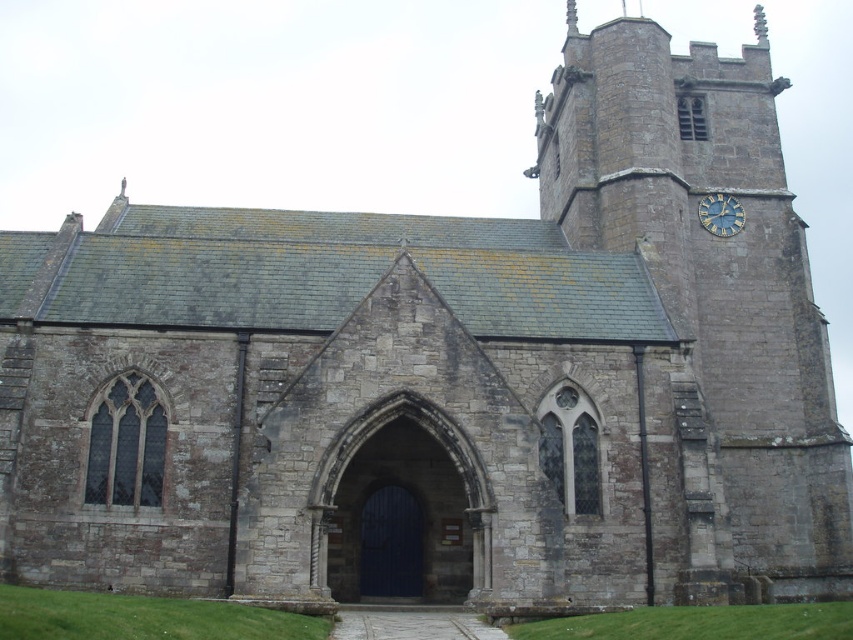
You are standing in front of the historic stone church and notice the stone clock tower at right and the gold metallic clock at upper right. Which object is wider from your perspective?

The stone clock tower at right is wider than the gold metallic clock at upper right according to the description.

You are standing in front of the historic stone church and notice two points marked on the building. One is at coordinate point (721, 499) and the other at point (717, 227). Which point is closer to you?

Point (721, 499) is closer to the camera than point (717, 227), so the point at (721, 499) is closer to you.

You are standing in front of the historic stone church and want to take a photo of the gold metallic clock at upper right. However, there is a stone clock tower at right blocking your view. Based on their positions, can you determine if the tower is to the left or right of the clock?

The stone clock tower at right is positioned on the left side of the gold metallic clock at upper right, so the tower is to the left of the clock.